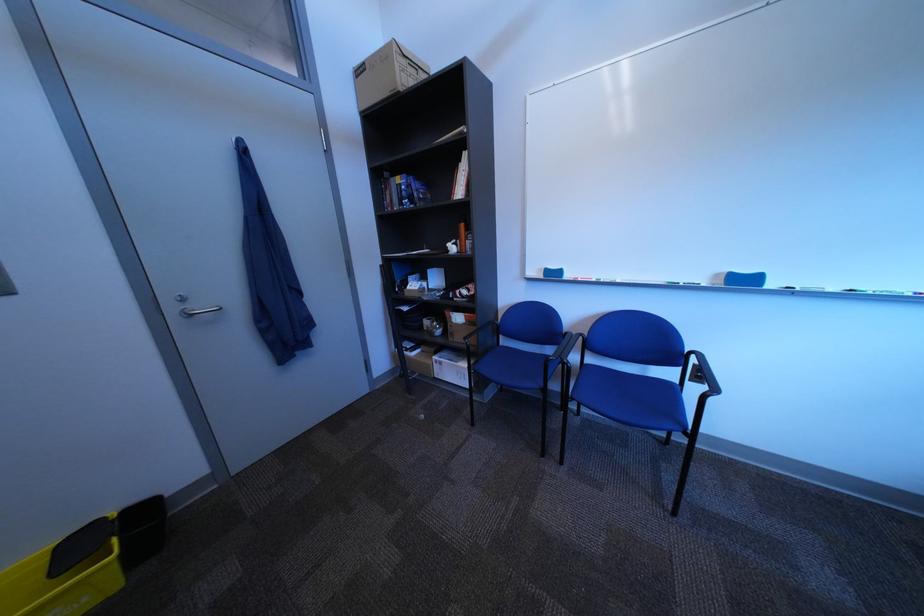
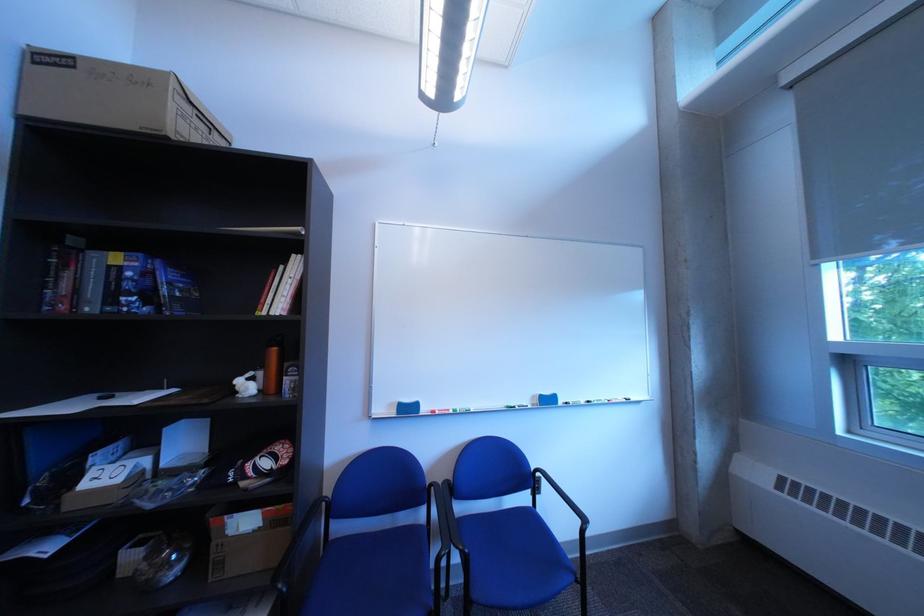
In the second image, find the point that corresponds to point (516, 347) in the first image.

(346, 541)